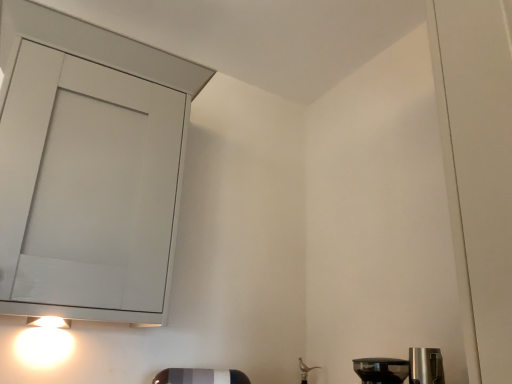
This screenshot has height=384, width=512. Identify the location of white glossy light at lower left. (42, 347).

Identify the location of matte white cabinet at upper left. (89, 168).

What do you see at coordinates (381, 370) in the screenshot?
I see `transparent plastic coffee maker at lower right` at bounding box center [381, 370].

Find the location of `white glossy light at lower left`. white glossy light at lower left is located at coordinates (42, 347).

Is transparent plastic coffee maker at lower right taller or shorter than matte white cabinet at upper left?

transparent plastic coffee maker at lower right is shorter than matte white cabinet at upper left.

Is transparent plastic coffee maker at lower right positioned with its back to matte white cabinet at upper left?

That's not correct — transparent plastic coffee maker at lower right is not looking away from matte white cabinet at upper left.

Is transparent plastic coffee maker at lower right far from matte white cabinet at upper left?

Actually, transparent plastic coffee maker at lower right and matte white cabinet at upper left are a little close together.

From the picture: Is transparent plastic coffee maker at lower right inside the boundaries of matte white cabinet at upper left, or outside?

transparent plastic coffee maker at lower right is spatially situated outside matte white cabinet at upper left.

Can you confirm if white glossy light at lower left is positioned to the left of matte white cabinet at upper left?

Yes.

Is white glossy light at lower left oriented towards matte white cabinet at upper left?

No, white glossy light at lower left is not aimed at matte white cabinet at upper left.

Based on the photo, from a real-world perspective, which object rests below the other?

From a 3D spatial view, white glossy light at lower left is below.

Looking at this image, who is bigger, white glossy light at lower left or matte white cabinet at upper left?

matte white cabinet at upper left.

In terms of width, does transparent plastic coffee maker at lower right look wider or thinner when compared to white glossy light at lower left?

transparent plastic coffee maker at lower right is wider than white glossy light at lower left.

What's the angular difference between transparent plastic coffee maker at lower right and white glossy light at lower left's facing directions?

The angular difference between transparent plastic coffee maker at lower right and white glossy light at lower left is 89.5 degrees.

At what (x,y) coordinates should I click in order to perform the action: click on appliance located on the right of white glossy light at lower left. Please return your answer as a coordinate pair (x, y). The image size is (512, 384). Looking at the image, I should click on (381, 370).

From the image's perspective, is transparent plastic coffee maker at lower right under white glossy light at lower left?

Indeed, from the image's perspective, transparent plastic coffee maker at lower right is shown beneath white glossy light at lower left.

Which is more to the right, matte white cabinet at upper left or white glossy light at lower left?

matte white cabinet at upper left.

Considering the relative sizes of matte white cabinet at upper left and white glossy light at lower left in the image provided, is matte white cabinet at upper left thinner than white glossy light at lower left?

No, matte white cabinet at upper left is not thinner than white glossy light at lower left.

Considering the relative sizes of matte white cabinet at upper left and white glossy light at lower left in the image provided, is matte white cabinet at upper left shorter than white glossy light at lower left?

No, matte white cabinet at upper left is not shorter than white glossy light at lower left.

From a real-world perspective, is white glossy light at lower left above or below transparent plastic coffee maker at lower right?

white glossy light at lower left is situated higher than transparent plastic coffee maker at lower right in the real world.

The image size is (512, 384). In order to click on appliance in front of the white glossy light at lower left in this screenshot , I will do `click(381, 370)`.

Considering the relative sizes of white glossy light at lower left and transparent plastic coffee maker at lower right in the image provided, is white glossy light at lower left thinner than transparent plastic coffee maker at lower right?

Yes, white glossy light at lower left is thinner than transparent plastic coffee maker at lower right.

Can we say matte white cabinet at upper left lies outside transparent plastic coffee maker at lower right?

Yes, matte white cabinet at upper left is outside of transparent plastic coffee maker at lower right.

Considering the sizes of objects matte white cabinet at upper left and transparent plastic coffee maker at lower right in the image provided, who is smaller, matte white cabinet at upper left or transparent plastic coffee maker at lower right?

Smaller between the two is transparent plastic coffee maker at lower right.

Is matte white cabinet at upper left positioned far away from transparent plastic coffee maker at lower right?

No.

Which is in front, matte white cabinet at upper left or transparent plastic coffee maker at lower right?

matte white cabinet at upper left is more forward.

Locate an element on the screen. The image size is (512, 384). appliance below the matte white cabinet at upper left (from the image's perspective) is located at coordinates (381, 370).

Where is `light behind the matte white cabinet at upper left`? The image size is (512, 384). light behind the matte white cabinet at upper left is located at coordinates (42, 347).

Consider the image. Considering their positions, is transparent plastic coffee maker at lower right positioned further to matte white cabinet at upper left than white glossy light at lower left?

transparent plastic coffee maker at lower right lies further to matte white cabinet at upper left than the other object.

Estimate the real-world distances between objects in this image. Which object is further from matte white cabinet at upper left, white glossy light at lower left or transparent plastic coffee maker at lower right?

Among the two, transparent plastic coffee maker at lower right is located further to matte white cabinet at upper left.

From the image, which object appears to be nearer to white glossy light at lower left, matte white cabinet at upper left or transparent plastic coffee maker at lower right?

Among the two, matte white cabinet at upper left is located nearer to white glossy light at lower left.

Considering their positions, is white glossy light at lower left positioned further to transparent plastic coffee maker at lower right than matte white cabinet at upper left?

Based on the image, white glossy light at lower left appears to be further to transparent plastic coffee maker at lower right.

Considering their positions, is transparent plastic coffee maker at lower right positioned further to white glossy light at lower left than matte white cabinet at upper left?

transparent plastic coffee maker at lower right is further to white glossy light at lower left.

Looking at this image, when comparing their distances from transparent plastic coffee maker at lower right, does matte white cabinet at upper left or white glossy light at lower left seem closer?

Among the two, matte white cabinet at upper left is located nearer to transparent plastic coffee maker at lower right.

The image size is (512, 384). I want to click on cabinetry between white glossy light at lower left and transparent plastic coffee maker at lower right in the horizontal direction, so click(x=89, y=168).